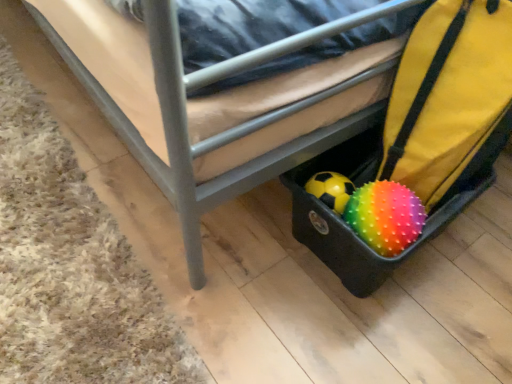
Question: Considering the positions of rainbow spiky ball at lower right and brown carpet at lower left in the image, is rainbow spiky ball at lower right wider or thinner than brown carpet at lower left?

Choices:
 (A) wide
 (B) thin

Answer: (B)

Question: In the image, is rainbow spiky ball at lower right on the left side or the right side of brown carpet at lower left?

Choices:
 (A) right
 (B) left

Answer: (A)

Question: Based on their relative distances, which object is nearer to the black plastic suitcase at lower right?

Choices:
 (A) brown carpet at lower left
 (B) rainbow spiky ball at lower right
 (C) rubberized black suitcase at lower right

Answer: (C)

Question: Estimate the real-world distances between objects in this image. Which object is closer to the rainbow spiky ball at lower right?

Choices:
 (A) black plastic suitcase at lower right
 (B) rubberized black suitcase at lower right
 (C) brown carpet at lower left

Answer: (B)